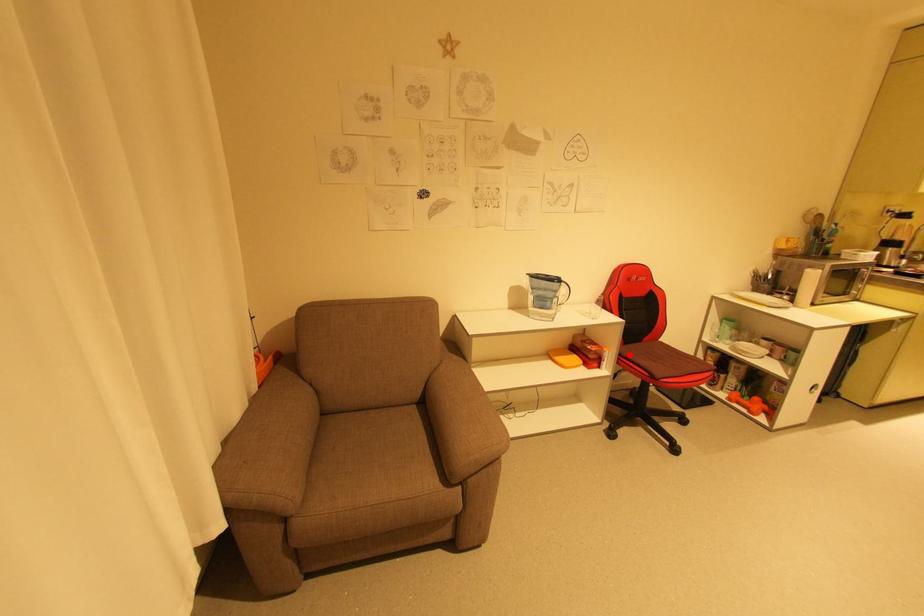
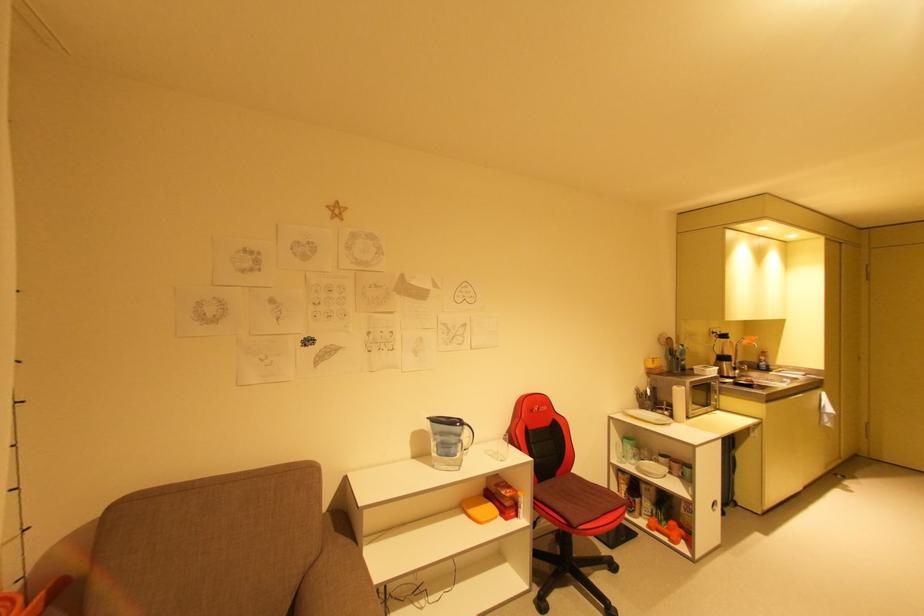
Question: I am providing you with two images of the same scene from different viewpoints. Given a red point in image1, look at the same physical point in image2. Is it:

Choices:
 (A) Closer to the viewpoint
 (B) Farther from the viewpoint

Answer: (B)